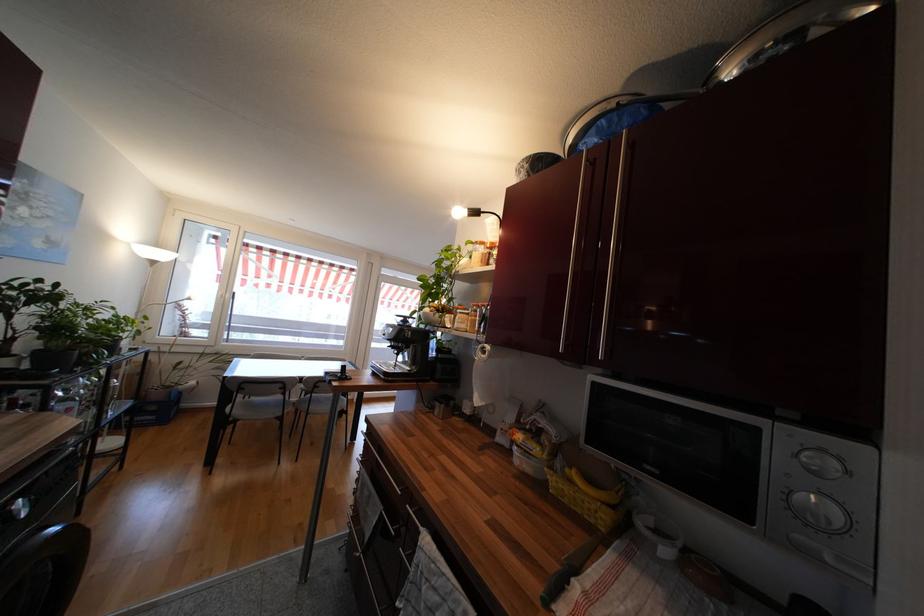
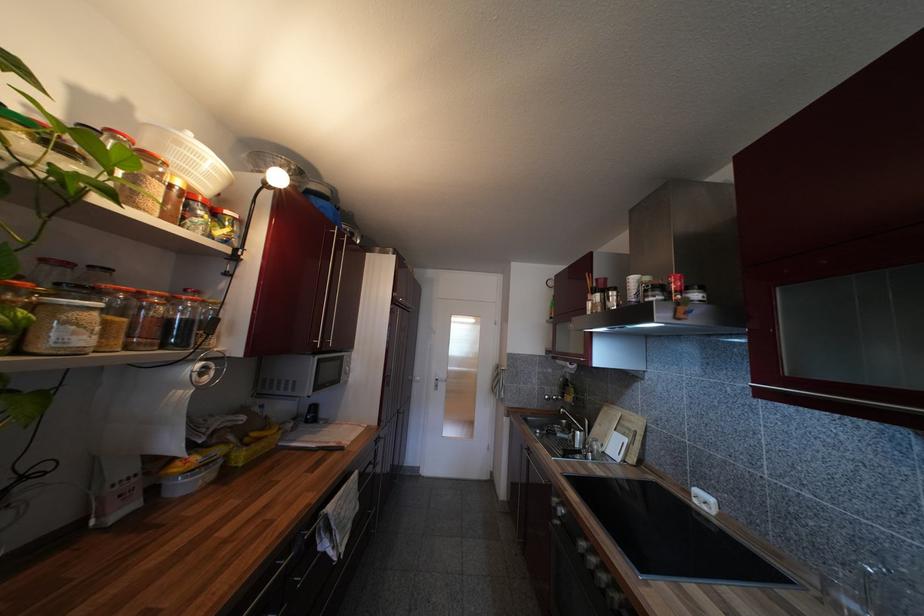
Where in the second image is the point corresponding to point (525, 446) from the first image?

(204, 464)